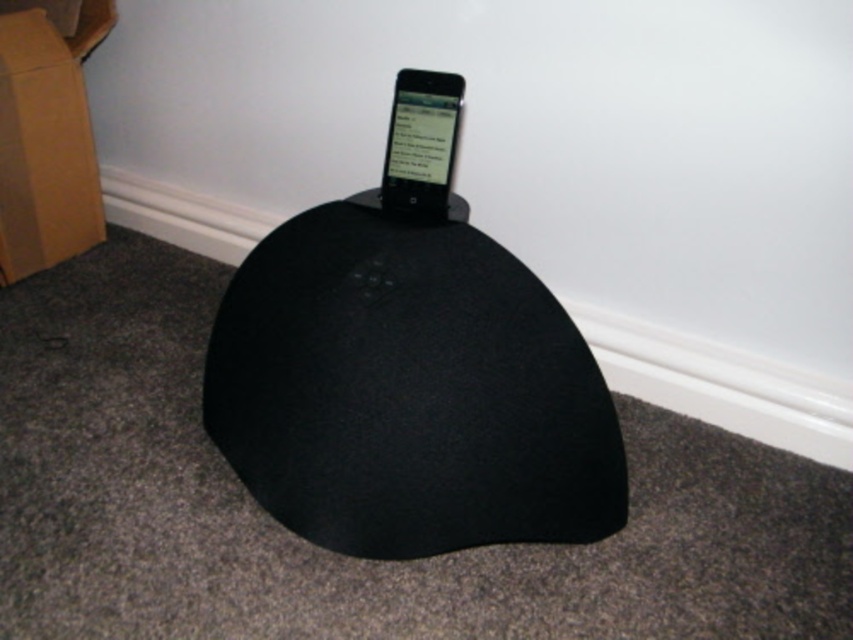
You are setting up a cozy reading corner and have a black fabric bean bag at center and a matte black phone at center. Which object is wider so you can use it as a seat?

The black fabric bean bag at center is wider than the matte black phone at center, so you can use it as a seat.